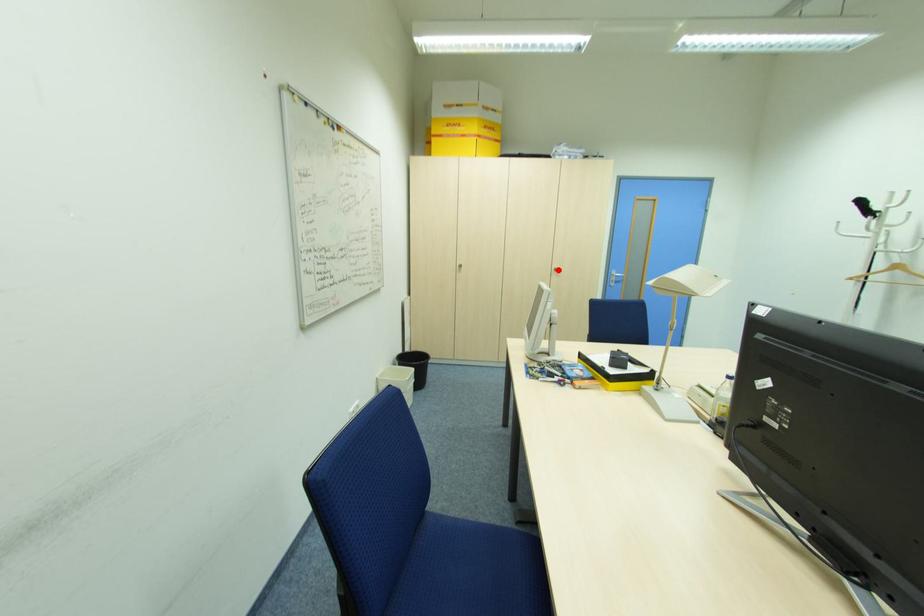
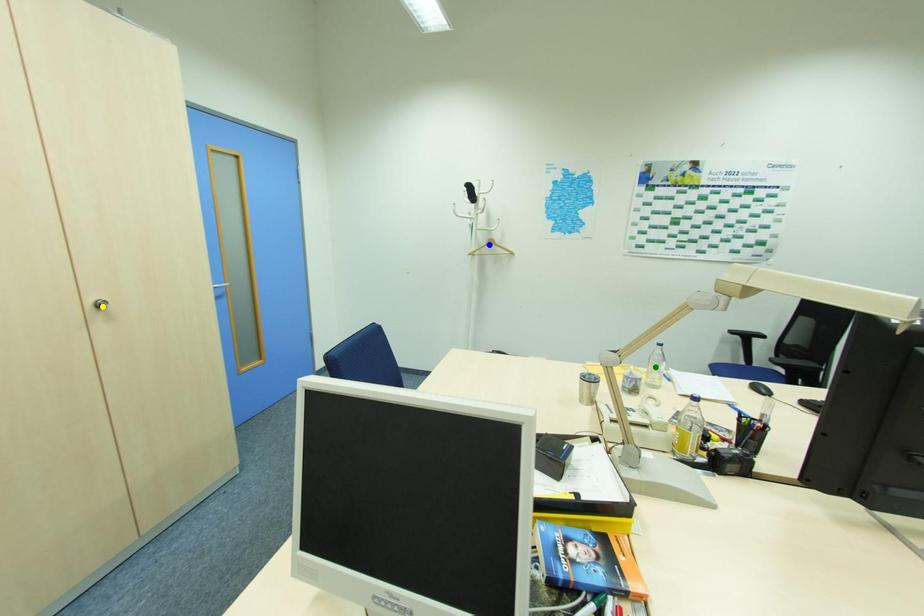
Question: I am providing you with two images of the same scene from different viewpoints. A red point is marked on the first image. You are given multiple points on the second image. Which point in image 2 is actually the same real-world point as the red point in image 1?

Choices:
 (A) yellow point
 (B) green point
 (C) blue point

Answer: (A)